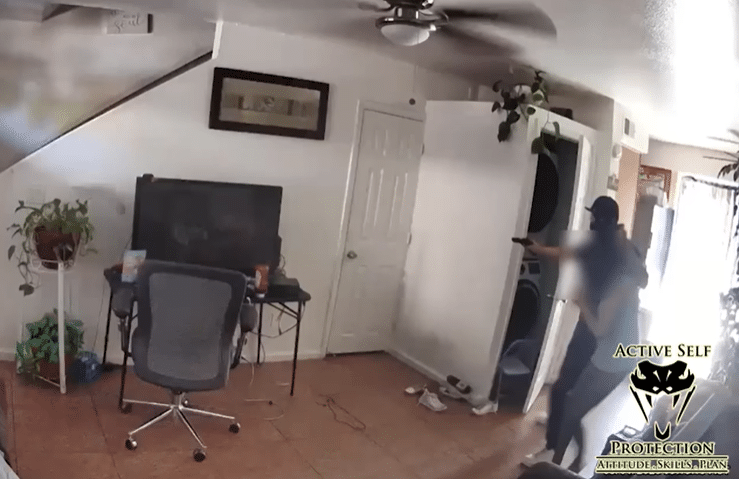
Identify the location of ceiling fan. This screenshot has width=739, height=479. (412, 29).